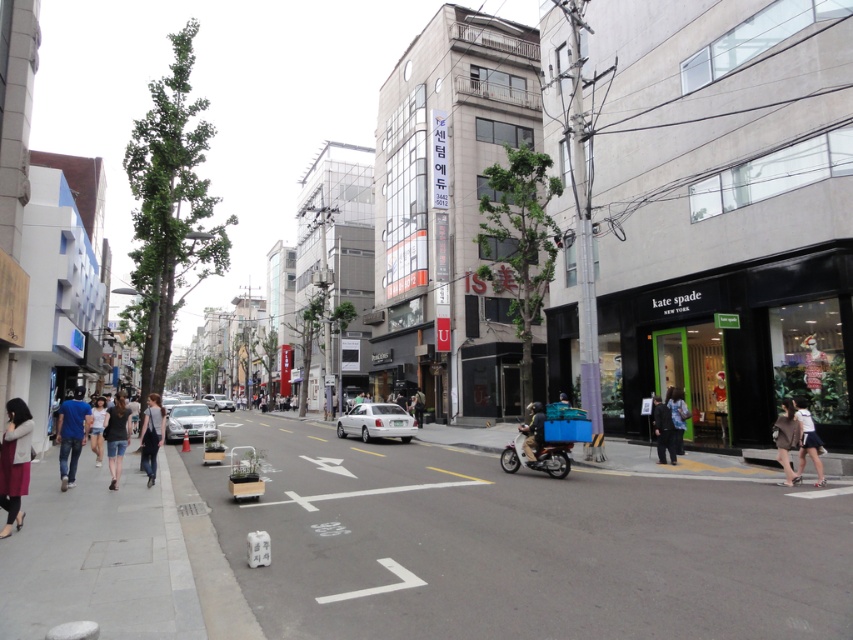
Question: Does white matte sedan at center have a smaller size compared to light brown leather shoes at lower right?

Choices:
 (A) yes
 (B) no

Answer: (B)

Question: Which object is farther from the camera taking this photo?

Choices:
 (A) white matte sedan at center
 (B) blue jeans at left
 (C) dark blue fabric jacket at center

Answer: (A)

Question: Which point is closer to the camera?

Choices:
 (A) silver metallic car at center
 (B) concrete sidewalk at lower left
 (C) light brown leather jacket at lower right
 (D) light brown leather shoes at lower right

Answer: (B)

Question: Which of the following is the closest to the observer?

Choices:
 (A) (196, 403)
 (B) (821, 480)

Answer: (B)

Question: Does black matte kate spade at center have a lesser width compared to denim pants at left?

Choices:
 (A) yes
 (B) no

Answer: (B)

Question: Is the position of blue jeans at left less distant than that of satin silver car at center?

Choices:
 (A) no
 (B) yes

Answer: (B)